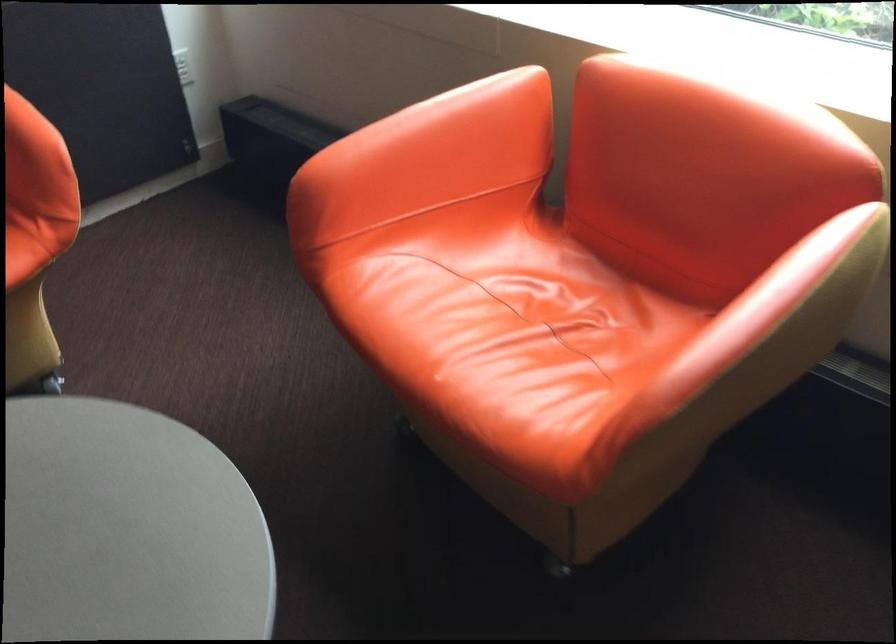
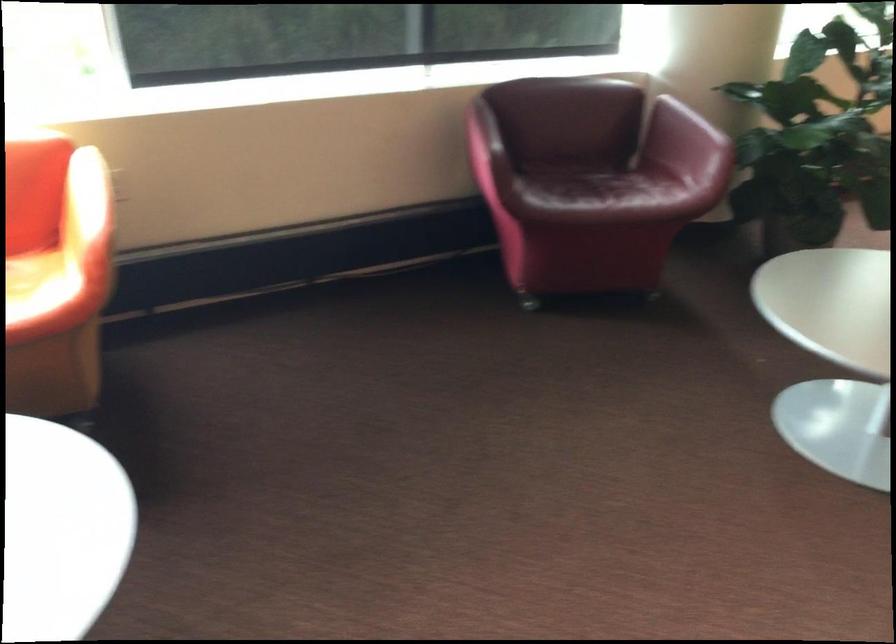
The point at (711,328) is marked in the first image. Where is the corresponding point in the second image?

(85, 200)